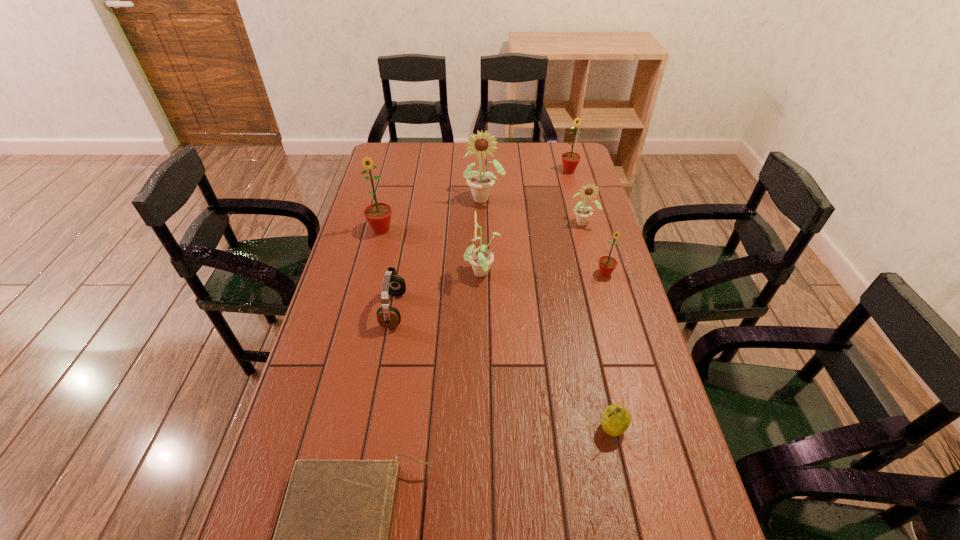
Identify the location of vacant position in the image that satisfies the following two spatial constraints: 1. on the front-facing side of the nearest yellow sunflower; 2. on the left side of the third shortest object. The height and width of the screenshot is (540, 960). (484, 428).

What are the coordinates of `vacant space that satisfies the following two spatial constraints: 1. on the face of the second smallest green sunflower; 2. on the front-facing side of the nearest yellow sunflower` in the screenshot? It's located at (596, 274).